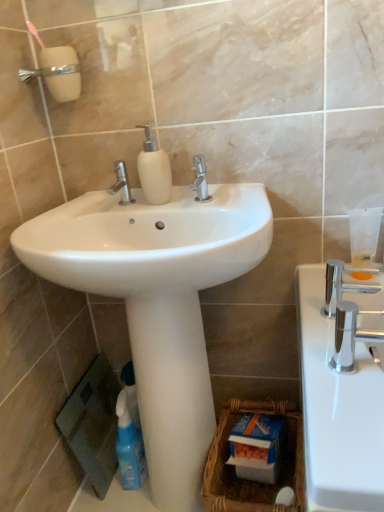
The image size is (384, 512). Identify the location of vacant region to the left of polished chrome faucet at center, the 2th tap in the bottom-to-top sequence. (80, 214).